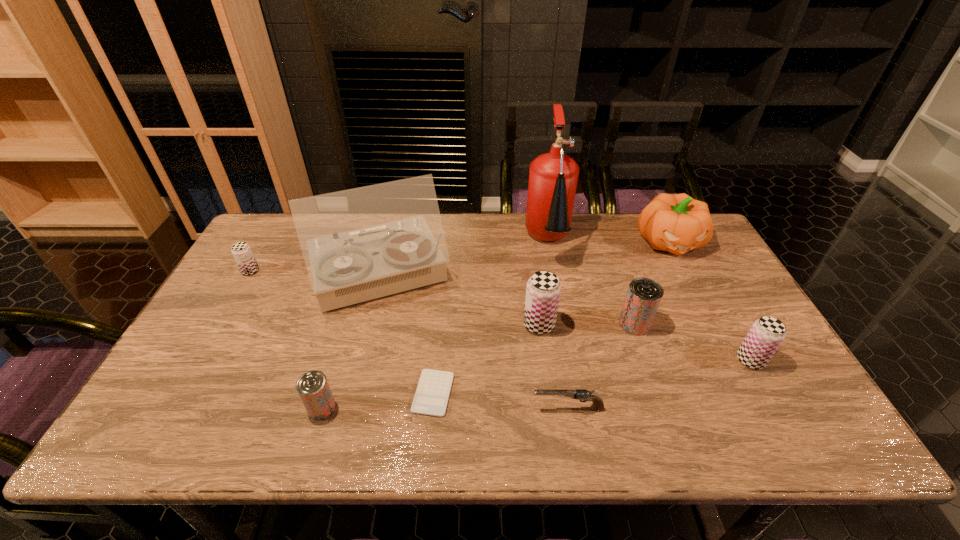
The height and width of the screenshot is (540, 960). In order to click on free spot between the white calculator and the tallest object in this screenshot , I will do `click(491, 318)`.

Locate an element on the screen. The image size is (960, 540). vacant area that lies between the second biggest purple beer can and the pumpkin is located at coordinates (710, 301).

This screenshot has height=540, width=960. Find the location of `free point between the ninth tallest object and the third beer can from right to left`. free point between the ninth tallest object and the third beer can from right to left is located at coordinates (554, 366).

You are a GUI agent. You are given a task and a screenshot of the screen. Output one action in this format:
    pyautogui.click(x=<x>, y=<y>)
    Task: Click on the object that is the fifth closest to the shortest object
    
    Given the screenshot: What is the action you would take?
    pyautogui.click(x=553, y=176)

Locate which object is the fourth closest to the white calculator. Please provide its 2D coordinates. Your answer should be formatted as a tuple, i.e. [(x, y)], where the tuple contains the x and y coordinates of a point satisfying the conditions above.

[(543, 290)]

Find the location of `beer can that is the fifth closest to the red fire extinguisher`. beer can that is the fifth closest to the red fire extinguisher is located at coordinates (241, 251).

Locate which beer can is the third closest to the ninth tallest object. Please provide its 2D coordinates. Your answer should be formatted as a tuple, i.e. [(x, y)], where the tuple contains the x and y coordinates of a point satisfying the conditions above.

[(765, 336)]

Select which purple beer can is the second closest to the shortest object. Please provide its 2D coordinates. Your answer should be formatted as a tuple, i.e. [(x, y)], where the tuple contains the x and y coordinates of a point satisfying the conditions above.

[(241, 251)]

Locate an element on the screen. purple beer can identified as the second closest to the pumpkin is located at coordinates (543, 290).

What are the coordinates of `free spot that satisfies the following two spatial constraints: 1. on the carved face of the pumpkin; 2. on the right side of the rightmost purple beer can` in the screenshot? It's located at (732, 360).